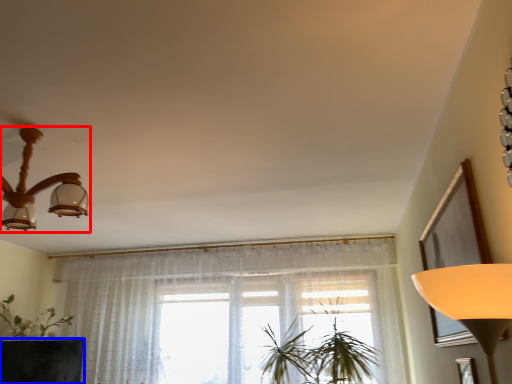
Question: Which object is closer to the camera taking this photo, lamp (highlighted by a red box) or round table (highlighted by a blue box)?

Choices:
 (A) lamp
 (B) round table

Answer: (A)